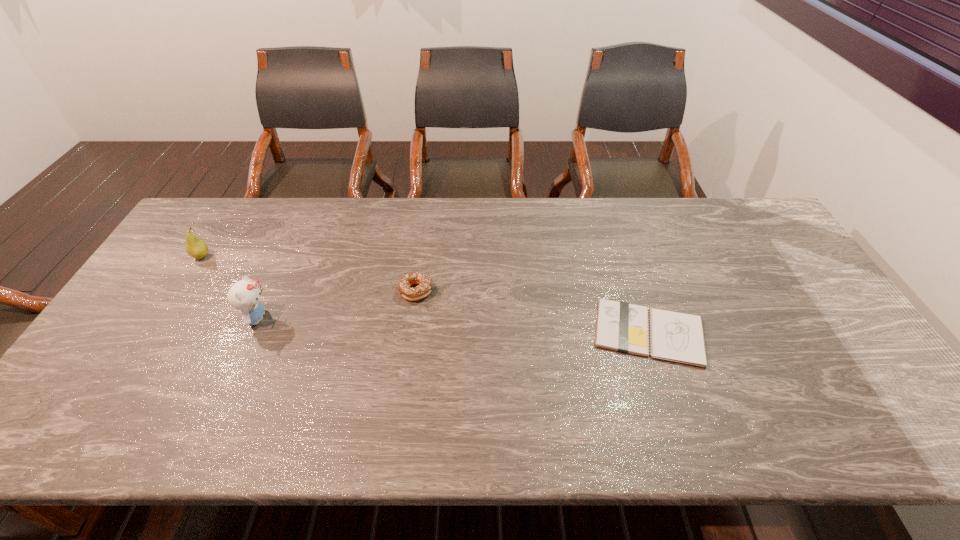
Locate an element on the screen. vacant space that satisfies the following two spatial constraints: 1. on the front side of the doughnut; 2. on the right side of the notepad is located at coordinates (411, 333).

Where is `free space that satisfies the following two spatial constraints: 1. on the front side of the second object from right to left; 2. on the left side of the pear`? Image resolution: width=960 pixels, height=540 pixels. free space that satisfies the following two spatial constraints: 1. on the front side of the second object from right to left; 2. on the left side of the pear is located at coordinates (180, 291).